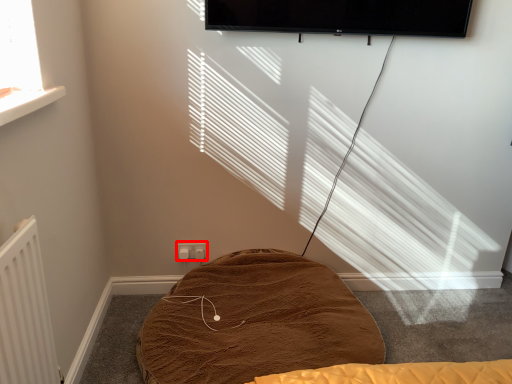
Question: From the image's perspective, where is electric outlet (annotated by the red box) located relative to furniture?

Choices:
 (A) above
 (B) below

Answer: (A)